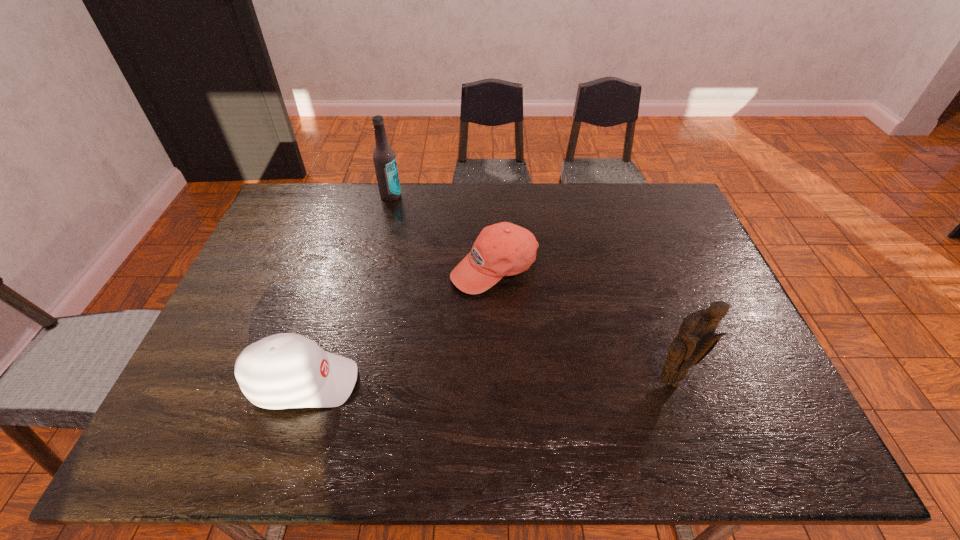
Find the location of a particular element. The width and height of the screenshot is (960, 540). vacant space situated on the label of the beer bottle is located at coordinates (409, 260).

The height and width of the screenshot is (540, 960). I want to click on vacant space located 0.340m on the label of the beer bottle, so click(411, 266).

The width and height of the screenshot is (960, 540). I want to click on vacant space situated on the label of the beer bottle, so click(x=413, y=271).

What are the coordinates of `object positioned at the far edge` in the screenshot? It's located at (384, 158).

Locate an element on the screen. This screenshot has height=540, width=960. baseball cap that is at the near edge is located at coordinates (286, 370).

Identify the location of figurine located in the near edge section of the desktop. Image resolution: width=960 pixels, height=540 pixels. (696, 339).

This screenshot has height=540, width=960. I want to click on object located in the left edge section of the desktop, so click(x=286, y=370).

Find the location of a particular element. The height and width of the screenshot is (540, 960). object that is positioned at the near left corner is located at coordinates (286, 370).

The image size is (960, 540). In the image, there is a desktop. In order to click on vacant space at the far edge in this screenshot , I will do `click(564, 206)`.

In order to click on free space at the near edge of the desktop in this screenshot , I will do click(x=588, y=390).